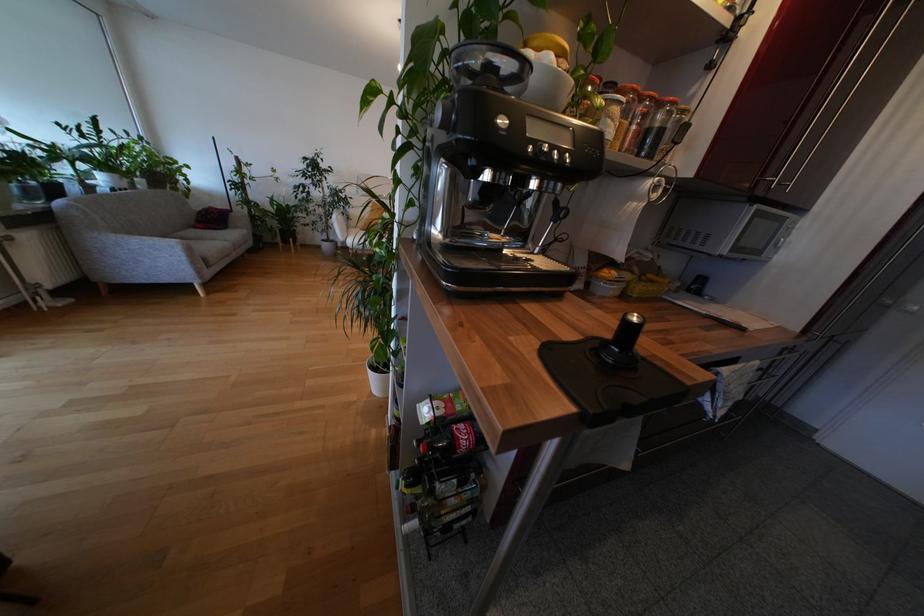
What do you see at coordinates (476, 195) in the screenshot? I see `a portafilter handle` at bounding box center [476, 195].